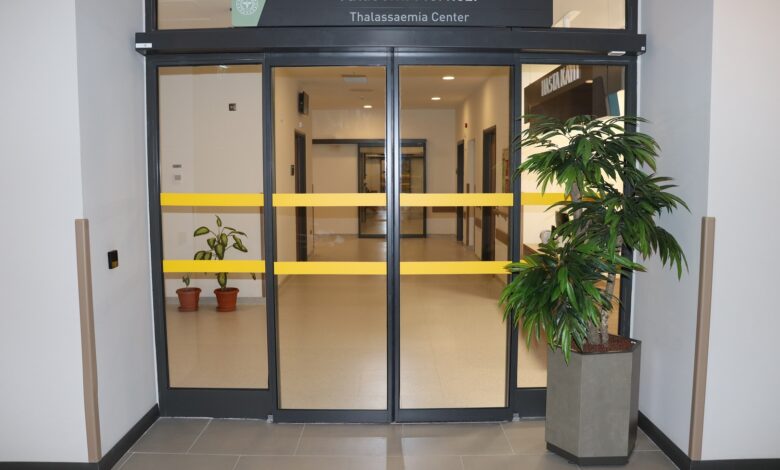
Where is `plant pots behind the doors`? This screenshot has width=780, height=470. plant pots behind the doors is located at coordinates (186, 298), (232, 301).